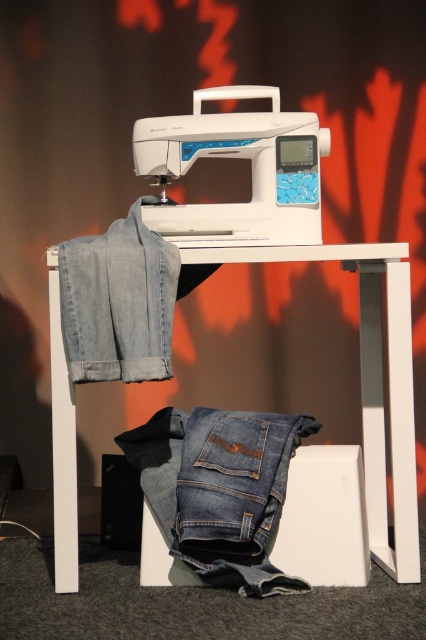
You are a photographer setting up a shot of the sewing machine and the jeans. You need to focus on the closest point between the two points, point 1 at point (222, 436) and point 2 at point (206, 209). Which point should you focus on?

Point (206, 209) is closer to the camera than point (222, 436), so you should focus on point (206, 209) to capture the closest point.

You are standing in front of the sewing table and want to reach both points on the table. Which point, point 1 at (368, 436) or point 2 at (282, 166), is closer to you?

Point 1 at (368, 436) is closer to you because it is further to the viewer than point 2 at (282, 166).